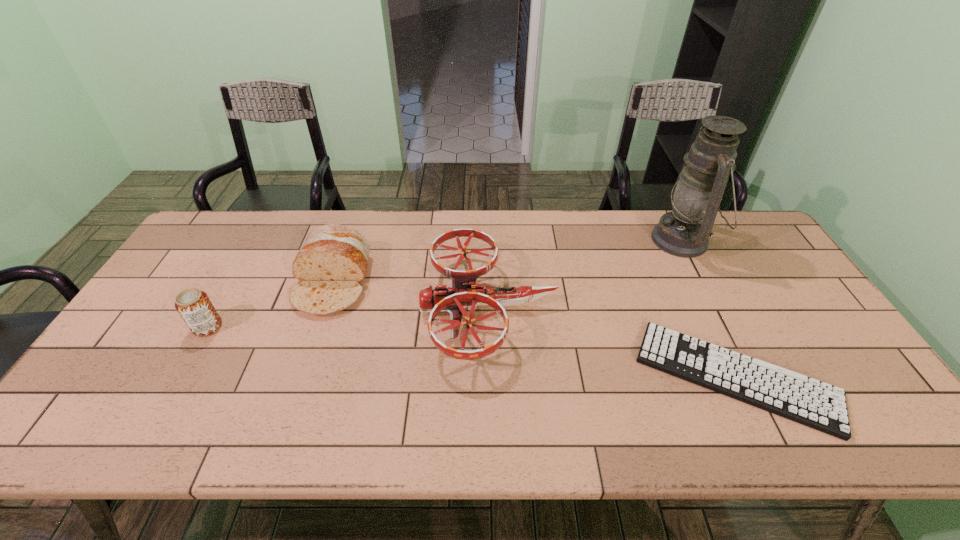
This screenshot has height=540, width=960. I want to click on oil lamp that is at the far edge, so click(697, 194).

In order to click on bread positioned at the far edge in this screenshot , I will do `click(331, 263)`.

What are the coordinates of `drone that is at the far edge` in the screenshot? It's located at point(463,293).

At what (x,y) coordinates should I click in order to perform the action: click on object that is at the near edge. Please return your answer as a coordinate pair (x, y). Looking at the image, I should click on (x=818, y=405).

Where is `object that is at the left edge`? This screenshot has height=540, width=960. object that is at the left edge is located at coordinates (194, 306).

Locate an element on the screen. object situated at the right edge is located at coordinates (818, 405).

Locate an element on the screen. object at the near right corner is located at coordinates (818, 405).

The width and height of the screenshot is (960, 540). I want to click on vacant position at the far edge of the desktop, so click(x=521, y=226).

The width and height of the screenshot is (960, 540). I want to click on vacant space at the right edge of the desktop, so (798, 300).

At what (x,y) coordinates should I click in order to perform the action: click on vacant region between the tallest object and the bread. Please return your answer as a coordinate pair (x, y). Looking at the image, I should click on (508, 261).